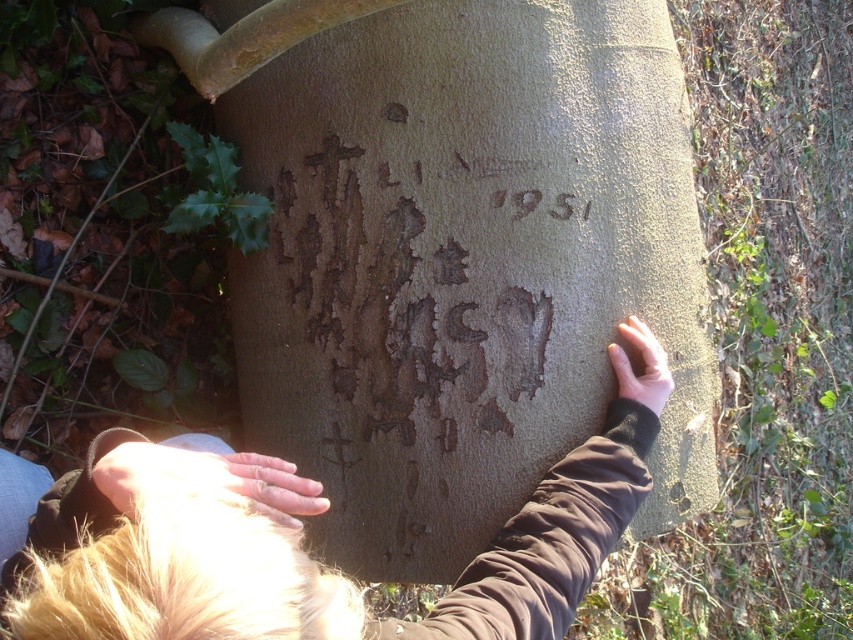
You are a sculptor observing the scene and want to place a small tool between the smooth skin hand at lower left and the smooth skin hand at center. Can you fit it there?

The smooth skin hand at lower left is positioned on the left side of smooth skin hand at center, so there is space between them to place the tool.